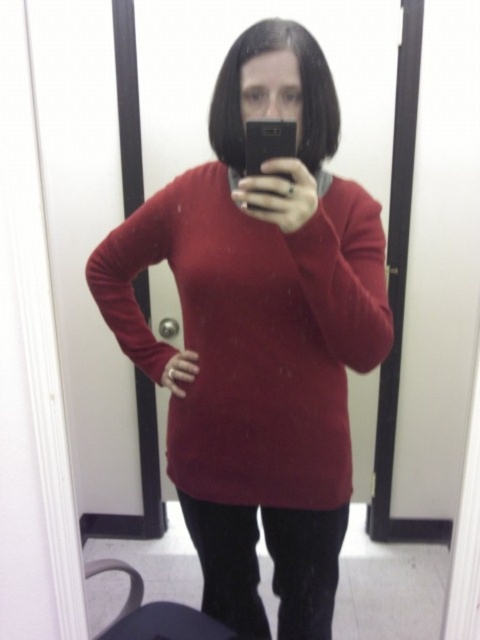
You are a fashion designer who needs to mark the exact location of the matte red sweater at center in the image. What are the coordinates where you should place your marker?

The coordinates for the matte red sweater at center are at point (254, 333).

You are a photographer trying to capture a closeup of the matte red sweater at center and the black glossy phone at upper center in the scene. Given that your camera can only focus on objects within a 10 inch range, will both items be in focus?

The matte red sweater at center is 12.19 inches away from the black glossy phone at upper center. Since the distance between them exceeds the camera focus range of 10 inches, they cannot both be in focus simultaneously.

In the dressing room scene, you see a matte red sweater at center and a black glossy phone at upper center. Which object is positioned to the left of the other?

The matte red sweater at center is to the left of the black glossy phone at upper center.